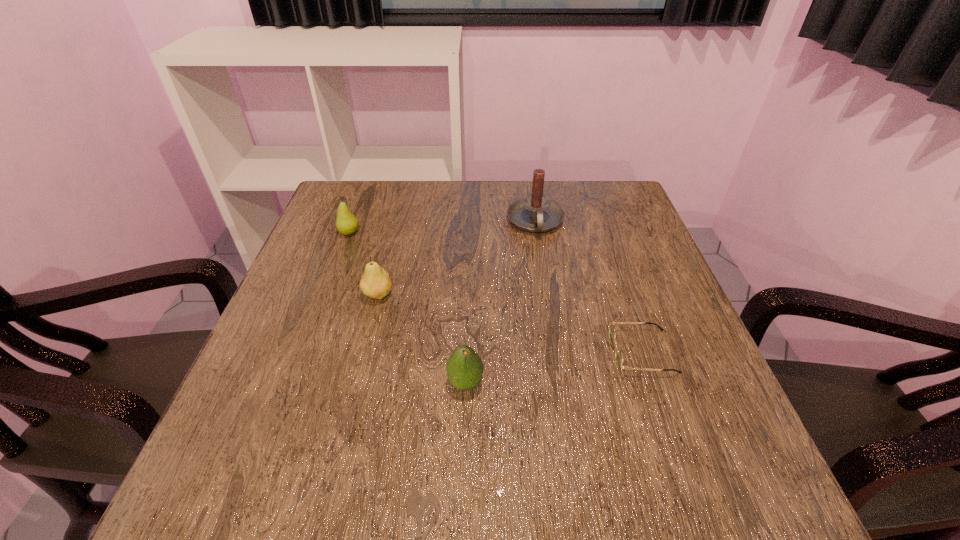
Where is `free space between the left pear and the candle`? The height and width of the screenshot is (540, 960). free space between the left pear and the candle is located at coordinates (443, 227).

Image resolution: width=960 pixels, height=540 pixels. I want to click on free space between the leftmost object and the second object from right to left, so click(x=443, y=227).

This screenshot has width=960, height=540. I want to click on empty space that is in between the left pear and the avocado, so click(407, 308).

Where is `vacant area that lies between the tallest object and the shortest object`? vacant area that lies between the tallest object and the shortest object is located at coordinates tap(588, 287).

Where is `empty location between the tallest object and the nearer pear`? empty location between the tallest object and the nearer pear is located at coordinates (457, 258).

Find the location of a particular element. free space between the tallest object and the second object from left to right is located at coordinates (457, 258).

This screenshot has width=960, height=540. Find the location of `free area in between the avocado and the left pear`. free area in between the avocado and the left pear is located at coordinates (407, 308).

Find the location of a particular element. The image size is (960, 540). object that ranks as the second closest to the third farthest object is located at coordinates (464, 367).

Identify which object is the second closest to the second object from left to right. Please provide its 2D coordinates. Your answer should be formatted as a tuple, i.e. [(x, y)], where the tuple contains the x and y coordinates of a point satisfying the conditions above.

[(464, 367)]